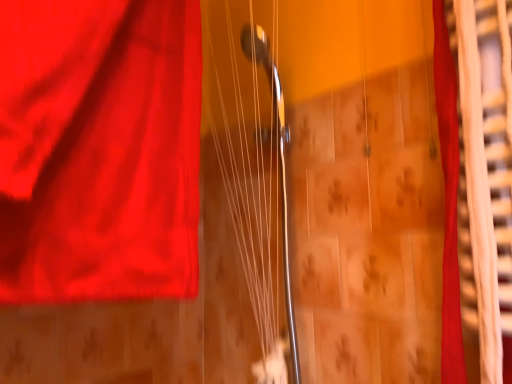
Question: Are silky red curtain at right and metallic silver strings at center located far from each other?

Choices:
 (A) no
 (B) yes

Answer: (A)

Question: Would you say metallic silver strings at center is part of silky red curtain at right's contents?

Choices:
 (A) no
 (B) yes

Answer: (A)

Question: Is silky red curtain at right thinner than metallic silver strings at center?

Choices:
 (A) no
 (B) yes

Answer: (B)

Question: Could you tell me if silky red curtain at right is turned towards metallic silver strings at center?

Choices:
 (A) yes
 (B) no

Answer: (B)

Question: Is silky red curtain at right at the left side of metallic silver strings at center?

Choices:
 (A) yes
 (B) no

Answer: (B)

Question: Considering the relative sizes of silky red curtain at right and metallic silver strings at center in the image provided, is silky red curtain at right smaller than metallic silver strings at center?

Choices:
 (A) no
 (B) yes

Answer: (B)

Question: Is metallic silver strings at center shorter than silky red curtain at right?

Choices:
 (A) yes
 (B) no

Answer: (B)

Question: Considering the relative sizes of metallic silver strings at center and silky red curtain at right in the image provided, is metallic silver strings at center smaller than silky red curtain at right?

Choices:
 (A) yes
 (B) no

Answer: (B)

Question: From the image's perspective, is metallic silver strings at center under silky red curtain at right?

Choices:
 (A) yes
 (B) no

Answer: (A)

Question: Are metallic silver strings at center and silky red curtain at right beside each other?

Choices:
 (A) yes
 (B) no

Answer: (B)

Question: Does metallic silver strings at center turn towards silky red curtain at right?

Choices:
 (A) no
 (B) yes

Answer: (A)

Question: Considering the relative sizes of metallic silver strings at center and silky red curtain at right in the image provided, is metallic silver strings at center bigger than silky red curtain at right?

Choices:
 (A) yes
 (B) no

Answer: (A)

Question: From the image's perspective, is metallic silver strings at center positioned above or below silky red curtain at right?

Choices:
 (A) below
 (B) above

Answer: (A)